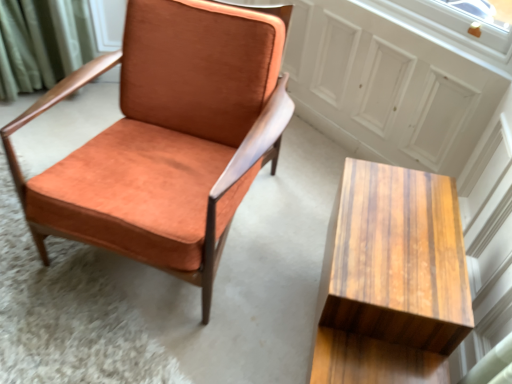
Question: Can you confirm if wooden table at lower right is positioned to the right of orange suede chair at center?

Choices:
 (A) yes
 (B) no

Answer: (A)

Question: Is the position of wooden table at lower right more distant than that of orange suede chair at center?

Choices:
 (A) yes
 (B) no

Answer: (B)

Question: Does wooden table at lower right have a larger size compared to orange suede chair at center?

Choices:
 (A) yes
 (B) no

Answer: (B)

Question: From the image's perspective, is wooden table at lower right on top of orange suede chair at center?

Choices:
 (A) yes
 (B) no

Answer: (B)

Question: From a real-world perspective, is wooden table at lower right under orange suede chair at center?

Choices:
 (A) yes
 (B) no

Answer: (A)

Question: Would you consider wooden table at lower right to be distant from orange suede chair at center?

Choices:
 (A) no
 (B) yes

Answer: (A)

Question: Can you confirm if orange suede chair at center is taller than wooden table at lower right?

Choices:
 (A) no
 (B) yes

Answer: (B)

Question: From the image's perspective, would you say orange suede chair at center is shown under wooden table at lower right?

Choices:
 (A) yes
 (B) no

Answer: (B)

Question: Considering the relative sizes of orange suede chair at center and wooden table at lower right in the image provided, is orange suede chair at center bigger than wooden table at lower right?

Choices:
 (A) no
 (B) yes

Answer: (B)

Question: Does orange suede chair at center appear on the right side of wooden table at lower right?

Choices:
 (A) yes
 (B) no

Answer: (B)

Question: Is orange suede chair at center closer to the viewer compared to wooden table at lower right?

Choices:
 (A) no
 (B) yes

Answer: (A)

Question: Are orange suede chair at center and wooden table at lower right located far from each other?

Choices:
 (A) no
 (B) yes

Answer: (A)

Question: Looking at the image, does orange suede chair at center seem bigger or smaller compared to wooden table at lower right?

Choices:
 (A) small
 (B) big

Answer: (B)